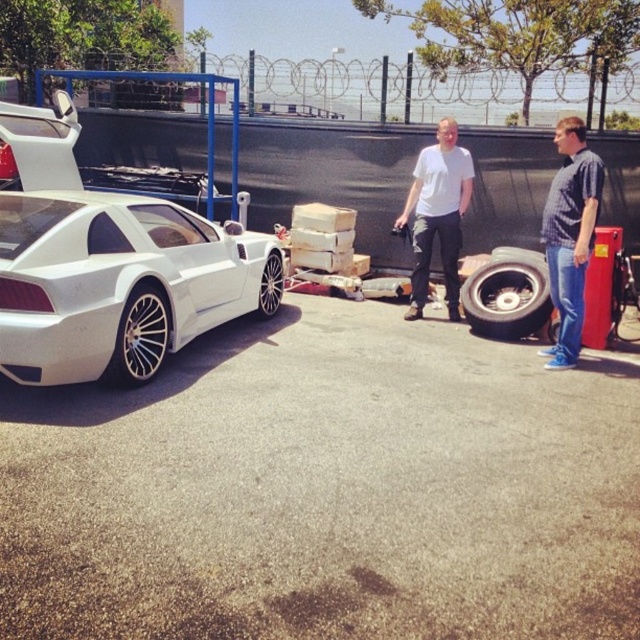
Question: Estimate the real-world distances between objects in this image. Which object is closer to the white matte shirt at center?

Choices:
 (A) blue plaid shirt at right
 (B) white matte sports car at left

Answer: (A)

Question: Can you confirm if white matte sports car at left is positioned to the right of white matte shirt at center?

Choices:
 (A) no
 (B) yes

Answer: (A)

Question: Which of the following is the closest to the observer?

Choices:
 (A) (426, 179)
 (B) (580, 166)
 (C) (90, 346)

Answer: (C)

Question: Is white matte sports car at left thinner than white matte shirt at center?

Choices:
 (A) yes
 (B) no

Answer: (B)

Question: Does blue plaid shirt at right appear under white matte shirt at center?

Choices:
 (A) no
 (B) yes

Answer: (B)

Question: Among these points, which one is nearest to the camera?

Choices:
 (A) (68, 276)
 (B) (554, 300)
 (C) (426, 237)

Answer: (A)